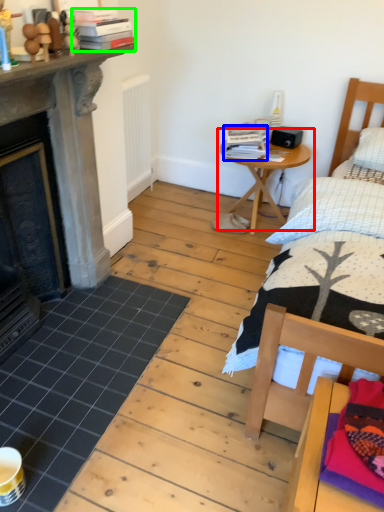
Question: Considering the real-world distances, which object is farthest from table (highlighted by a red box)? book (highlighted by a blue box) or book (highlighted by a green box)?

Choices:
 (A) book
 (B) book

Answer: (B)